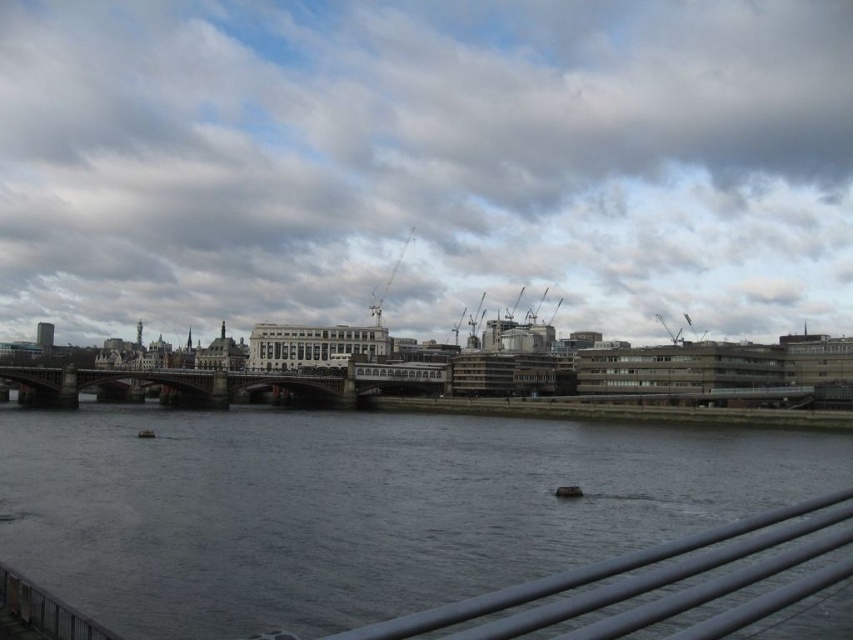
You are standing on a bridge and want to take a photo of the dark gray water at center and the satin silver rail at lower center. Which object appears closer to the camera in the photo?

The satin silver rail at lower center appears closer to the camera because it is taller than the dark gray water at center.

You are a photographer planning to capture a wide shot of the river scene. You want to ensure that both the metallic gray crane at upper center and the white plastic boat at lower center are clearly visible in your photo. Given their sizes, which object might require more careful framing to ensure it doesn not get lost in the composition?

The white plastic boat at lower center might require more careful framing because it is smaller in size compared to the metallic gray crane at upper center, making it easier to get lost in the composition.